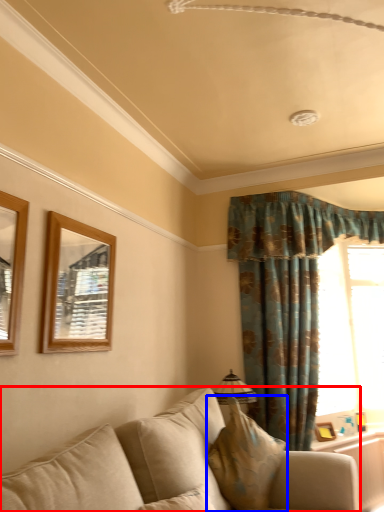
Question: Which of the following is the farthest to the observer, studio couch (highlighted by a red box) or pillow (highlighted by a blue box)?

Choices:
 (A) studio couch
 (B) pillow

Answer: (B)